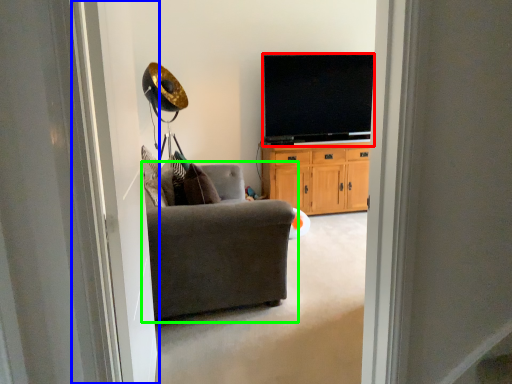
Question: Based on their relative distances, which object is nearer to television (highlighted by a red box)? Choose from screen door (highlighted by a blue box) and chair (highlighted by a green box).

Choices:
 (A) screen door
 (B) chair

Answer: (B)